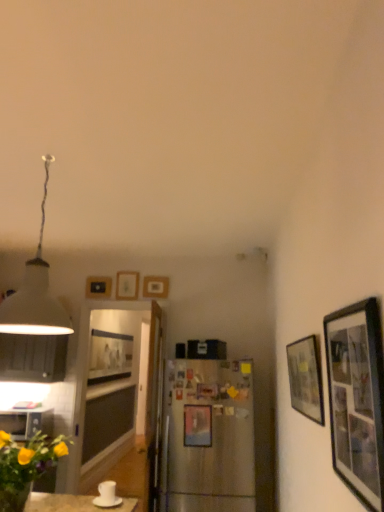
Question: Which direction should I rotate to face wooden picture frame at upper center, which ranks as the fourth picture frame in left-to-right order, — up or down?

Choices:
 (A) down
 (B) up

Answer: (A)

Question: Is the depth of matte black picture frame at center, the first picture frame viewed from the left, greater than that of white matte lampshade at upper left?

Choices:
 (A) no
 (B) yes

Answer: (B)

Question: Considering the relative sizes of matte black picture frame at center, which appears as the 1th picture frame when viewed from the back, and white matte lampshade at upper left in the image provided, is matte black picture frame at center, which appears as the 1th picture frame when viewed from the back, shorter than white matte lampshade at upper left?

Choices:
 (A) no
 (B) yes

Answer: (B)

Question: Is matte black picture frame at center, which appears as the 1th picture frame when viewed from the back, to the left of white matte lampshade at upper left from the viewer's perspective?

Choices:
 (A) no
 (B) yes

Answer: (B)

Question: Would you say matte black picture frame at center, which appears as the 1th picture frame when viewed from the back, is outside white matte lampshade at upper left?

Choices:
 (A) no
 (B) yes

Answer: (B)

Question: Can you confirm if matte black picture frame at center, placed as the 7th picture frame when sorted from front to back, is taller than white matte lampshade at upper left?

Choices:
 (A) yes
 (B) no

Answer: (B)

Question: Is white matte lampshade at upper left inside matte black picture frame at center, placed as the 7th picture frame when sorted from front to back?

Choices:
 (A) no
 (B) yes

Answer: (A)

Question: Is matte black picture frame at right, which appears as the 7th picture frame when viewed from the left, behind white glossy coffee cup at lower left?

Choices:
 (A) yes
 (B) no

Answer: (B)

Question: Does matte black picture frame at right, which appears as the 7th picture frame when viewed from the left, appear on the left side of white glossy coffee cup at lower left?

Choices:
 (A) yes
 (B) no

Answer: (B)

Question: From a real-world perspective, is matte black picture frame at right, which appears as the 7th picture frame when viewed from the left, over white glossy coffee cup at lower left?

Choices:
 (A) no
 (B) yes

Answer: (B)

Question: Does matte black picture frame at right, which appears as the 7th picture frame when viewed from the left, have a greater width compared to white glossy coffee cup at lower left?

Choices:
 (A) no
 (B) yes

Answer: (A)

Question: Is white glossy coffee cup at lower left at the back of matte black picture frame at right, the 1th picture frame in the right-to-left sequence?

Choices:
 (A) yes
 (B) no

Answer: (B)

Question: Is matte black picture frame at right, which appears as the 7th picture frame when viewed from the left, to the right of white glossy coffee cup at lower left from the viewer's perspective?

Choices:
 (A) yes
 (B) no

Answer: (A)

Question: Is metallic silver picture frame at center, which appears as the third picture frame when viewed from the front, turned away from matte black picture frame at right, which ranks as the 6th picture frame in back-to-front order?

Choices:
 (A) no
 (B) yes

Answer: (A)